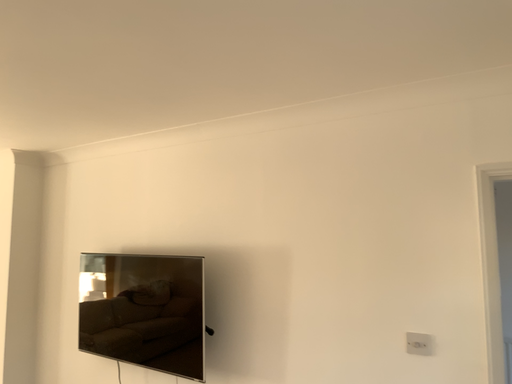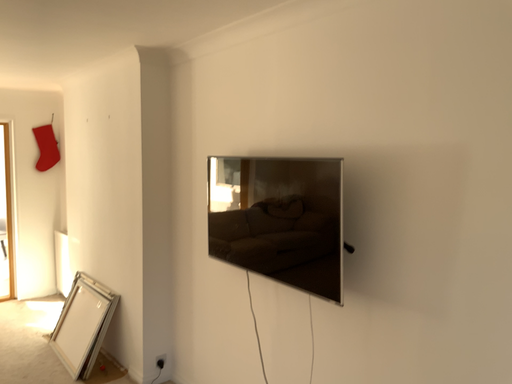
Question: Which way did the camera rotate in the video?

Choices:
 (A) rotated left
 (B) rotated right

Answer: (A)